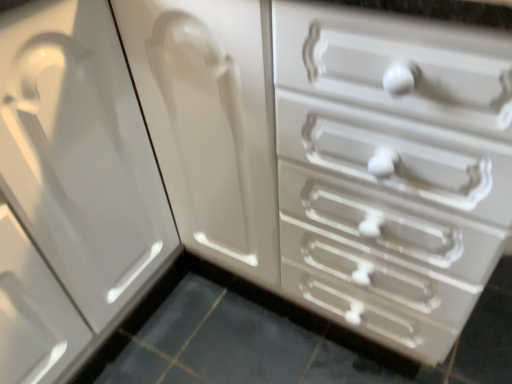
The width and height of the screenshot is (512, 384). Describe the element at coordinates (71, 189) in the screenshot. I see `glossy white oven door at left` at that location.

This screenshot has height=384, width=512. Identify the location of glossy white oven door at left. (71, 189).

I want to click on glossy white oven door at left, so click(71, 189).